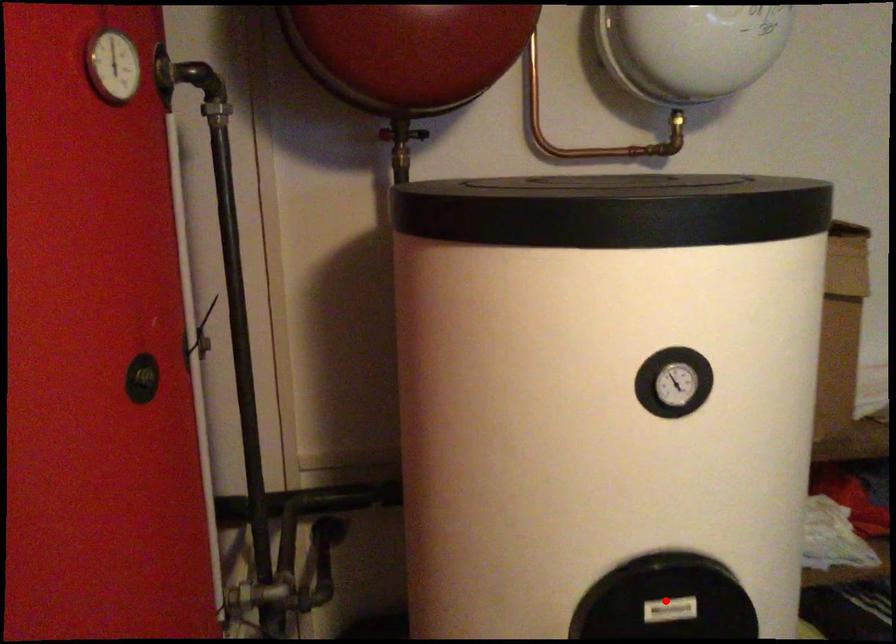
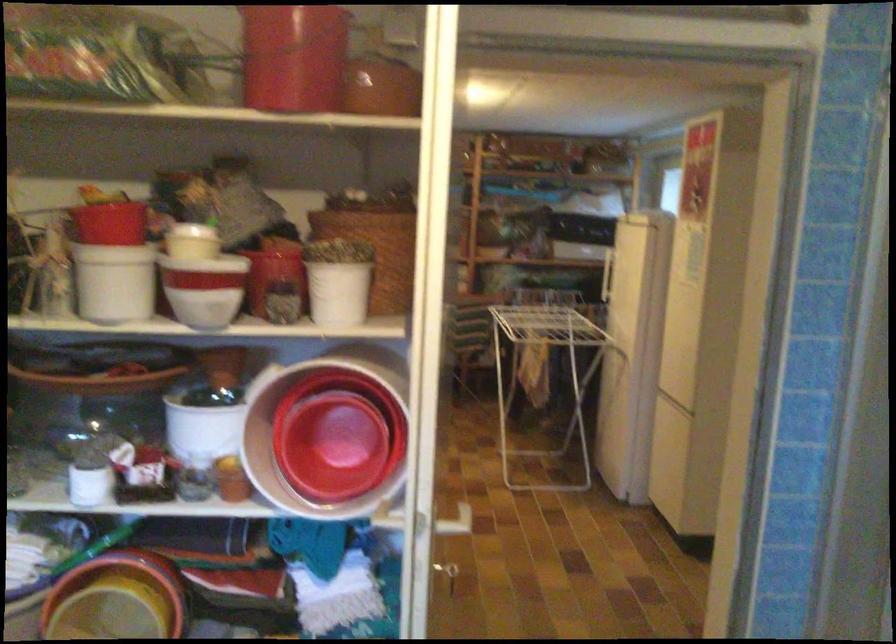
Question: I am providing you with two images of the same scene from different viewpoints. A red point is marked on the first image. Can you still see the location of the red point in image 2?

Choices:
 (A) Yes
 (B) No

Answer: (B)